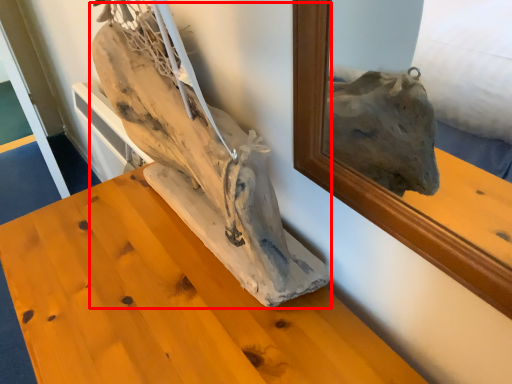
Question: From the image's perspective, where is sculpture (annotated by the red box) located in relation to furniture in the image?

Choices:
 (A) above
 (B) below

Answer: (A)